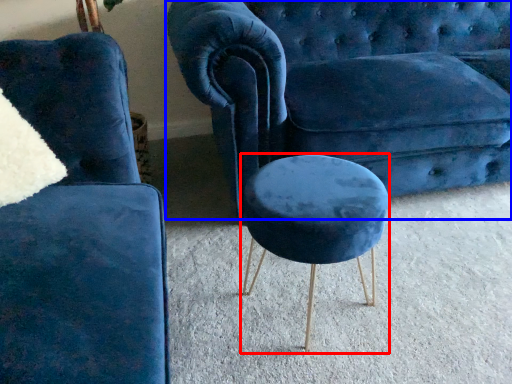
Question: Which object appears closest to the camera in this image, stool (highlighted by a red box) or studio couch (highlighted by a blue box)?

Choices:
 (A) stool
 (B) studio couch

Answer: (A)